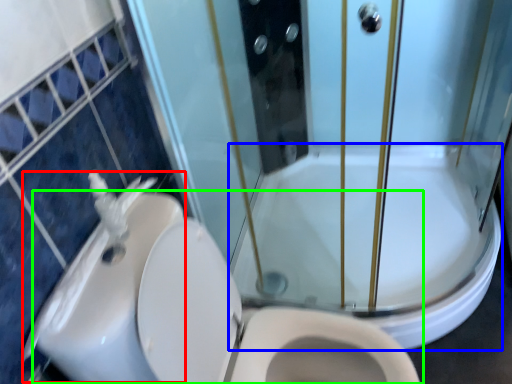
Question: Which object is positioned closest to sink (highlighted by a red box)? Select from bath (highlighted by a blue box) and toilet (highlighted by a green box).

Choices:
 (A) bath
 (B) toilet

Answer: (B)